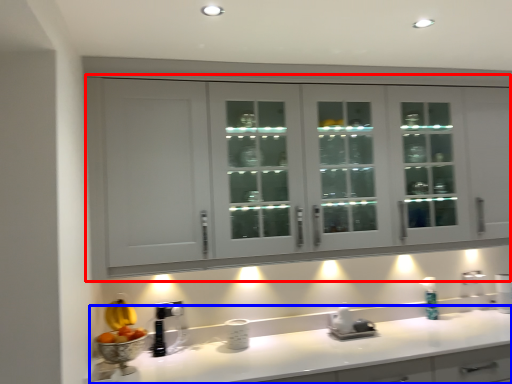
Question: Which object is closer to the camera taking this photo, cabinetry (highlighted by a red box) or countertop (highlighted by a blue box)?

Choices:
 (A) cabinetry
 (B) countertop

Answer: (B)